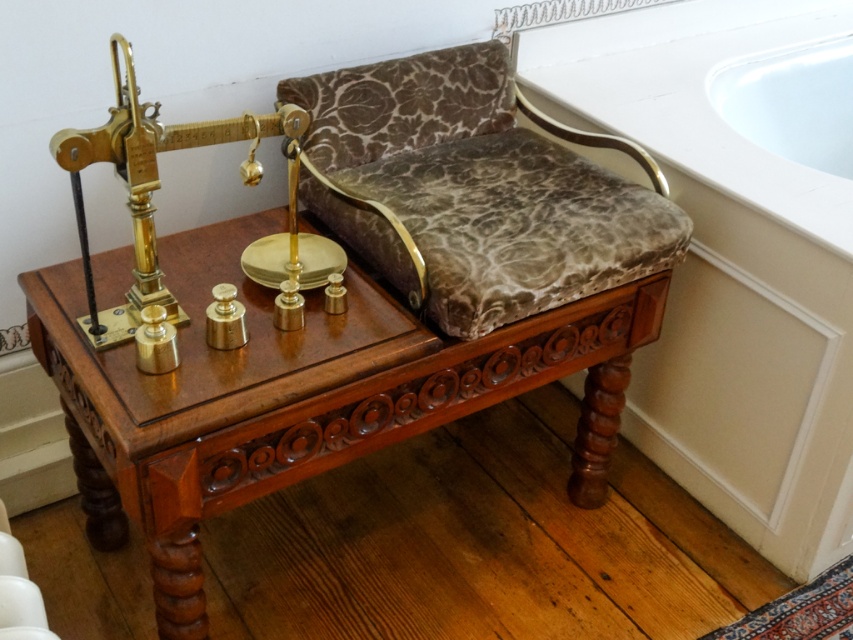
Between mahogany wood table at center and white glossy bathtub at upper right, which one has less height?

white glossy bathtub at upper right

Is point (186, 451) farther from viewer compared to point (784, 74)?

No, (186, 451) is in front of (784, 74).

Between point (196, 477) and point (746, 56), which one is positioned behind?

Positioned behind is point (746, 56).

At what (x,y) coordinates should I click in order to perform the action: click on mahogany wood table at center. Please return your answer as a coordinate pair (x, y). This screenshot has height=640, width=853. Looking at the image, I should click on (x=296, y=396).